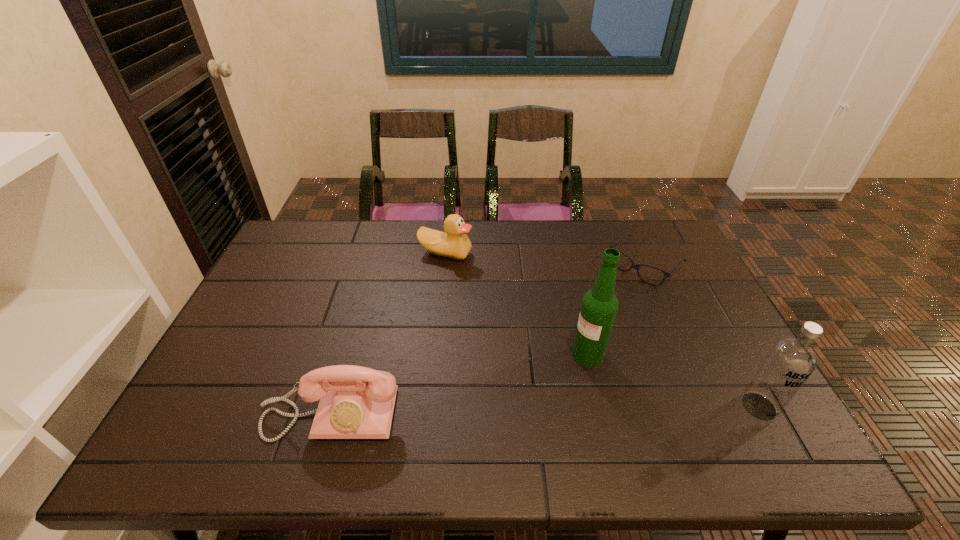
Identify the location of spectacles that is at the right edge. Image resolution: width=960 pixels, height=540 pixels. (636, 266).

Locate an element on the screen. The width and height of the screenshot is (960, 540). object that is at the far right corner is located at coordinates (636, 266).

Find the location of a particular element. The height and width of the screenshot is (540, 960). object situated at the near right corner is located at coordinates (790, 361).

In the image, there is a desktop. Where is `free space at the far edge`? free space at the far edge is located at coordinates (488, 239).

Where is `vacant area at the near edge`? vacant area at the near edge is located at coordinates (553, 397).

Locate an element on the screen. This screenshot has height=540, width=960. vacant space at the left edge of the desktop is located at coordinates click(239, 341).

Find the location of a particular element. free location at the right edge is located at coordinates (660, 277).

Where is `free region at the far left corner of the desktop`? The image size is (960, 540). free region at the far left corner of the desktop is located at coordinates (312, 220).

Locate an element on the screen. free space at the far right corner is located at coordinates 648,235.

At what (x,y) coordinates should I click in order to perform the action: click on vacant region between the fourth shortest object and the telephone. Please return your answer as a coordinate pair (x, y). This screenshot has width=960, height=540. Looking at the image, I should click on (544, 410).